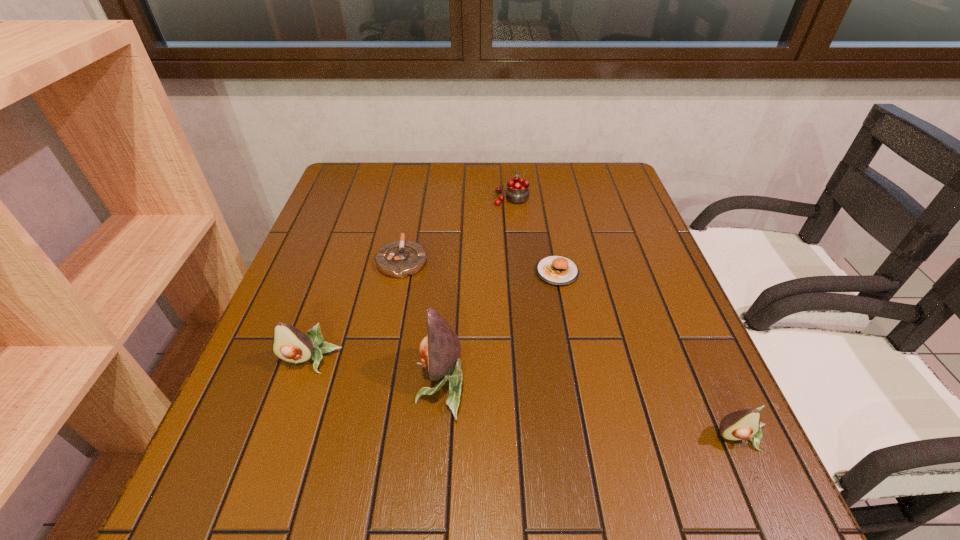
To make them evenly spaced by inserting another avocado among them, please locate a free space for this new avocado. Please provide its 2D coordinates. Your answer should be formatted as a tuple, i.e. [(x, y)], where the tuple contains the x and y coordinates of a point satisfying the conditions above.

[(584, 409)]